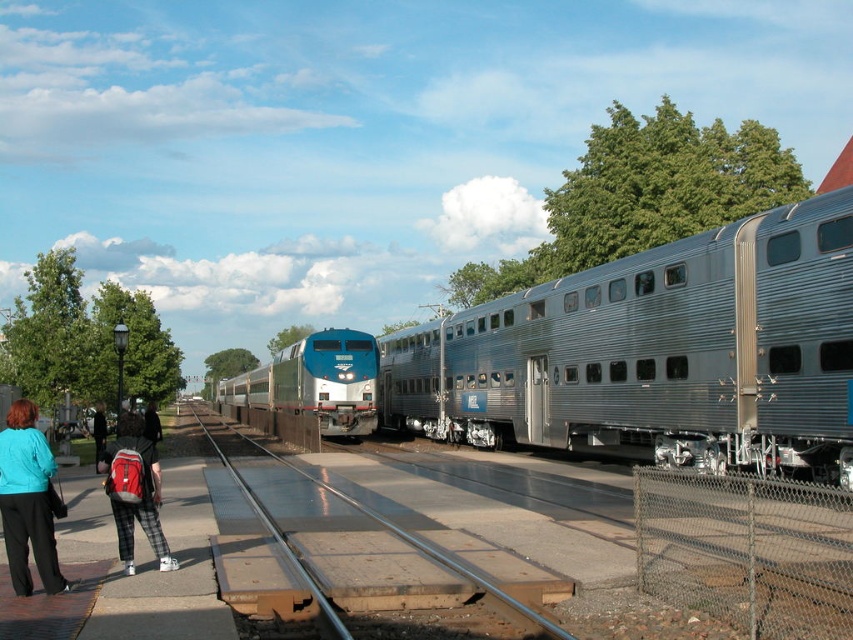
Question: Where is shiny blue train at center located in relation to red backpack at lower left in the image?

Choices:
 (A) right
 (B) left

Answer: (B)

Question: Can you confirm if teal fabric jacket at lower left is wider than red backpack at lower left?

Choices:
 (A) yes
 (B) no

Answer: (B)

Question: Can you confirm if silver/aluminum train car at center-right is positioned to the right of shiny blue train at center?

Choices:
 (A) no
 (B) yes

Answer: (B)

Question: Which point is closer to the camera?

Choices:
 (A) metal/smooth train track at center
 (B) red backpack at lower left
 (C) shiny blue train at center

Answer: (A)

Question: Which object is closer to the camera taking this photo?

Choices:
 (A) red backpack at lower left
 (B) metal/smooth train track at center
 (C) teal fabric jacket at lower left
 (D) shiny blue train at center

Answer: (B)

Question: Which point is closer to the camera?

Choices:
 (A) red backpack at lower left
 (B) metal/smooth train track at center

Answer: (B)